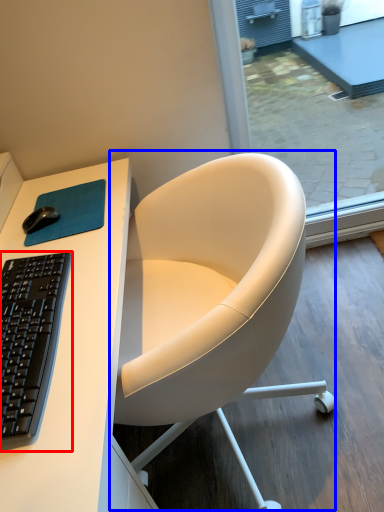
Question: Which object appears closest to the camera in this image, computer keyboard (highlighted by a red box) or chair (highlighted by a blue box)?

Choices:
 (A) computer keyboard
 (B) chair

Answer: (A)